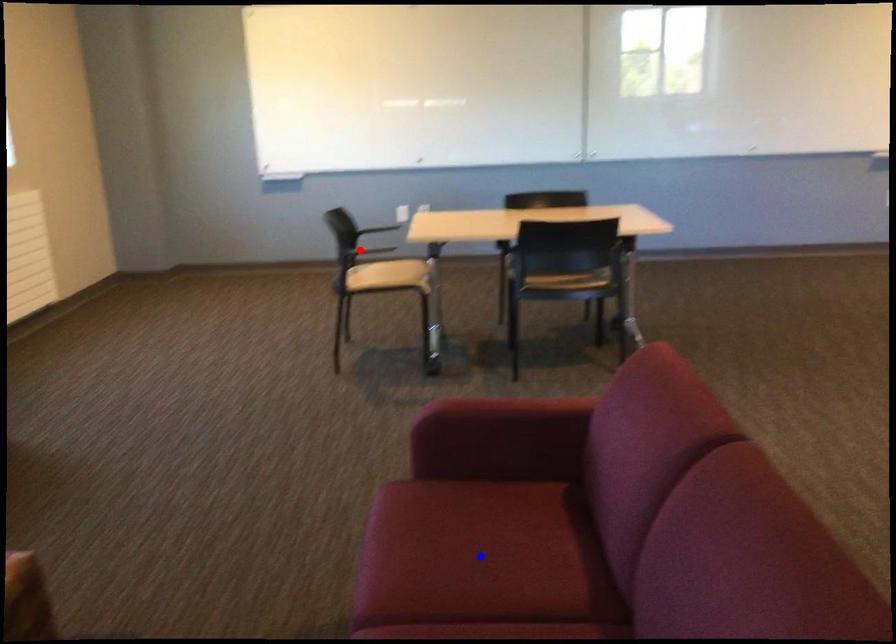
Question: Which of the two points in the image is closer to the camera?

Choices:
 (A) Blue point is closer.
 (B) Red point is closer.

Answer: (A)